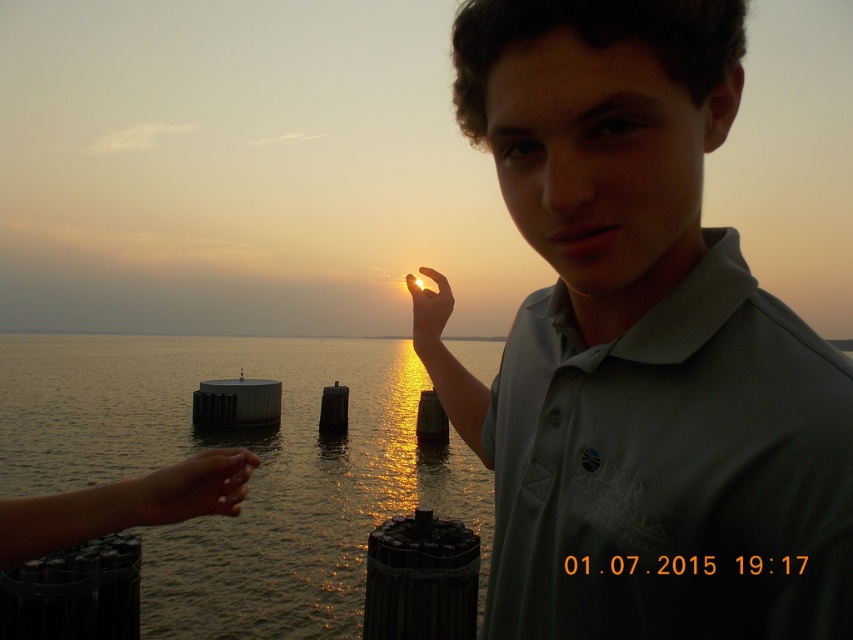
Who is positioned more to the left, matte green polo shirt at center or glistening water at center?

From the viewer's perspective, glistening water at center appears more on the left side.

Can you confirm if matte green polo shirt at center is positioned to the right of glistening water at center?

Indeed, matte green polo shirt at center is positioned on the right side of glistening water at center.

What do you see at coordinates (642, 346) in the screenshot? The width and height of the screenshot is (853, 640). I see `matte green polo shirt at center` at bounding box center [642, 346].

Image resolution: width=853 pixels, height=640 pixels. What are the coordinates of `matte green polo shirt at center` in the screenshot? It's located at (642, 346).

Who is more forward, (634, 477) or (428, 337)?

Point (634, 477) is in front.

Is point (573, 488) farther from viewer compared to point (421, 300)?

No, (573, 488) is closer to viewer.

Image resolution: width=853 pixels, height=640 pixels. I want to click on matte green polo shirt at center, so click(x=642, y=346).

Between matte green polo shirt at center and smooth skin hand at lower left, which one has less height?

smooth skin hand at lower left

Does matte green polo shirt at center have a lesser width compared to smooth skin hand at lower left?

Incorrect, matte green polo shirt at center's width is not less than smooth skin hand at lower left's.

The width and height of the screenshot is (853, 640). Find the location of `matte green polo shirt at center`. matte green polo shirt at center is located at coordinates (642, 346).